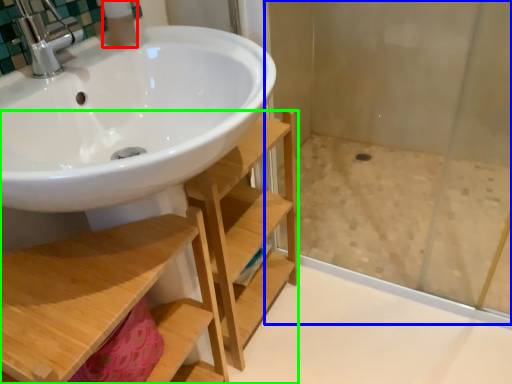
Question: Considering the real-world distances, which object is closest to toiletry (highlighted by a red box)? shower door (highlighted by a blue box) or shelf (highlighted by a green box).

Choices:
 (A) shower door
 (B) shelf

Answer: (B)